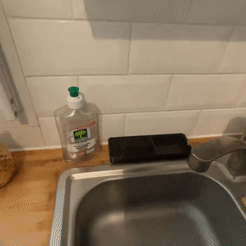
This screenshot has height=246, width=246. What are the coordinates of `dish detergent` in the screenshot? It's located at (76, 130).